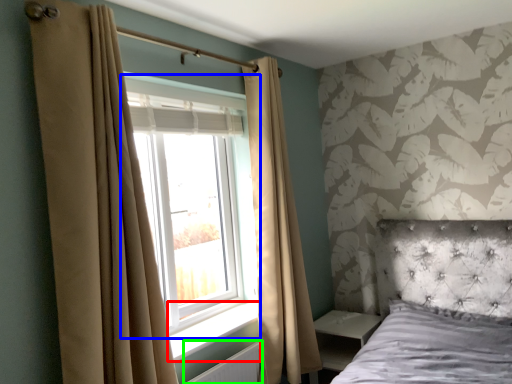
Question: Which object is positioned closest to window sill (highlighted by a red box)? Select from window (highlighted by a blue box) and radiator (highlighted by a green box).

Choices:
 (A) window
 (B) radiator

Answer: (B)